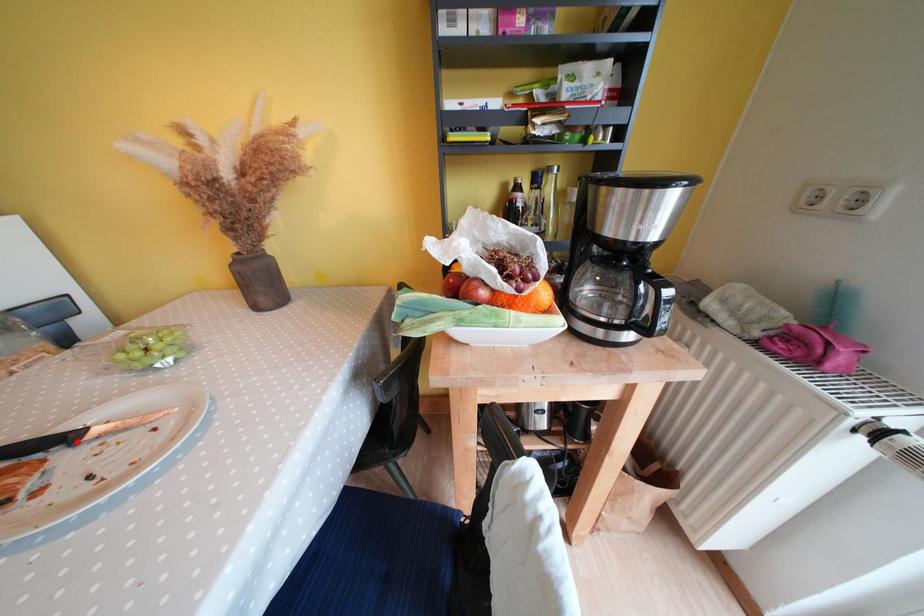
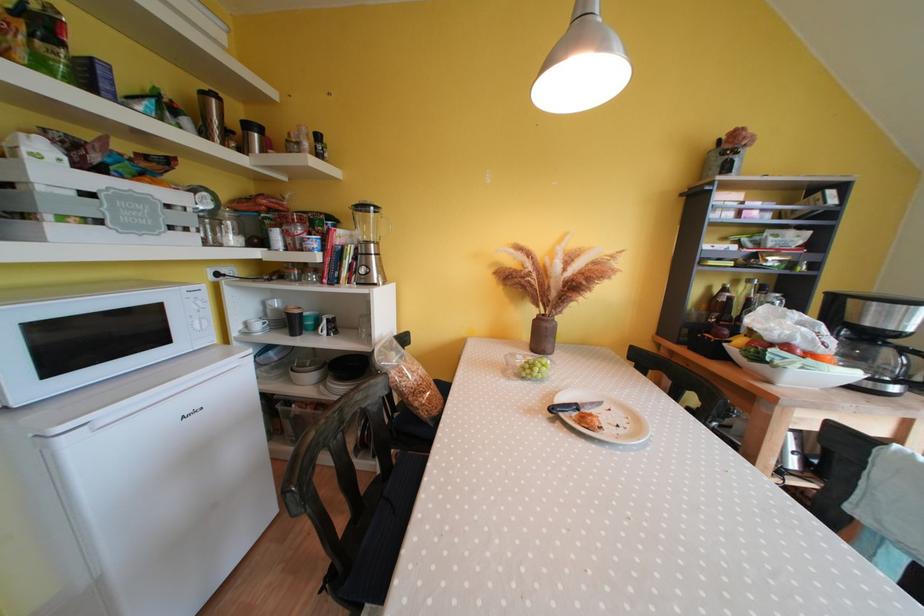
Locate, in the second image, the point that corresponds to the highlighted location in the first image.

(582, 410)